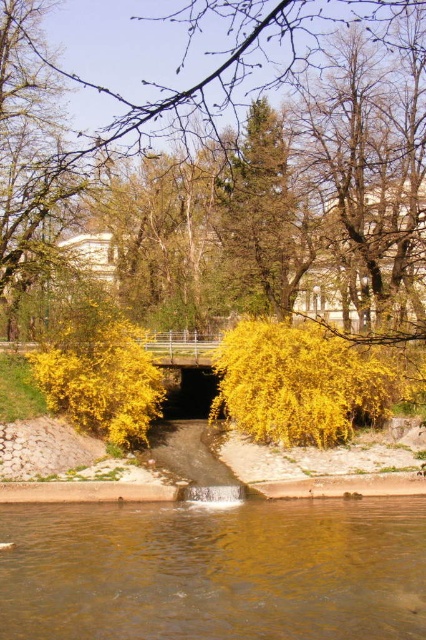
Does point (100, 582) lie in front of point (192, 112)?

Yes, it is.

Between brown liquid water at lower center and yellow leafy tree at center, which one is positioned lower?

brown liquid water at lower center is below.

Is point (423, 579) farther from camera compared to point (72, 193)?

No, it is not.

The image size is (426, 640). Identify the location of brown liquid water at lower center. (215, 570).